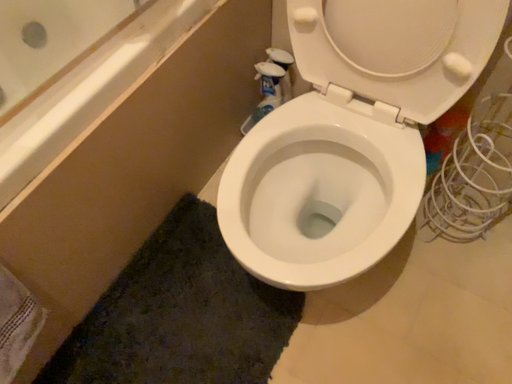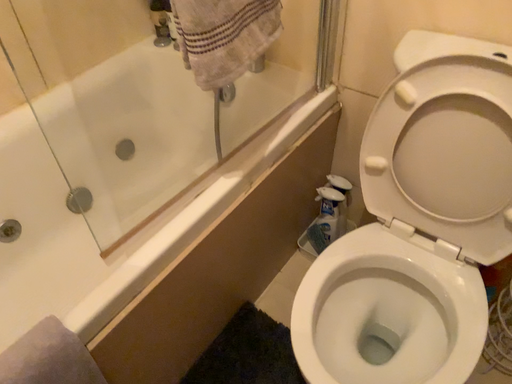
Question: How did the camera likely rotate when shooting the video?

Choices:
 (A) rotated upward
 (B) rotated downward

Answer: (A)